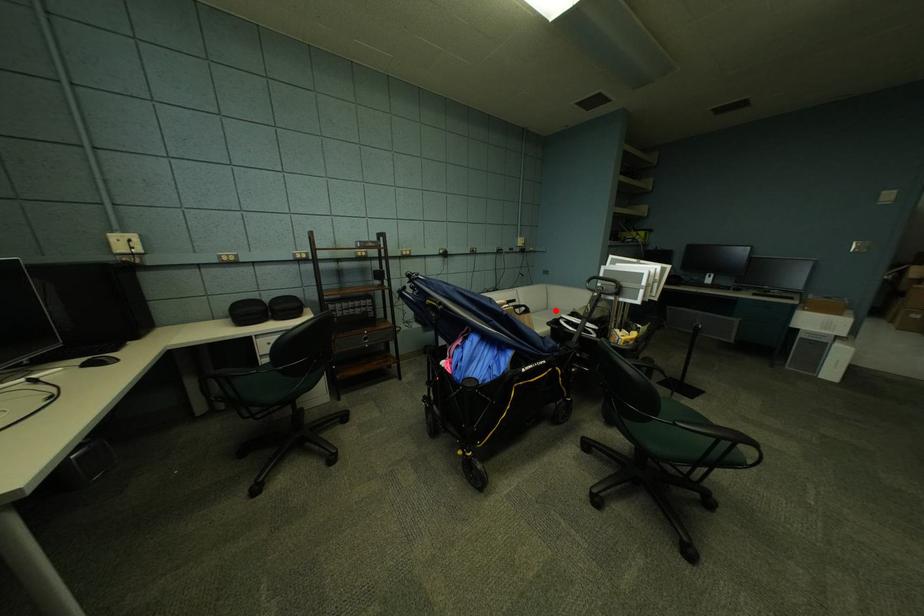
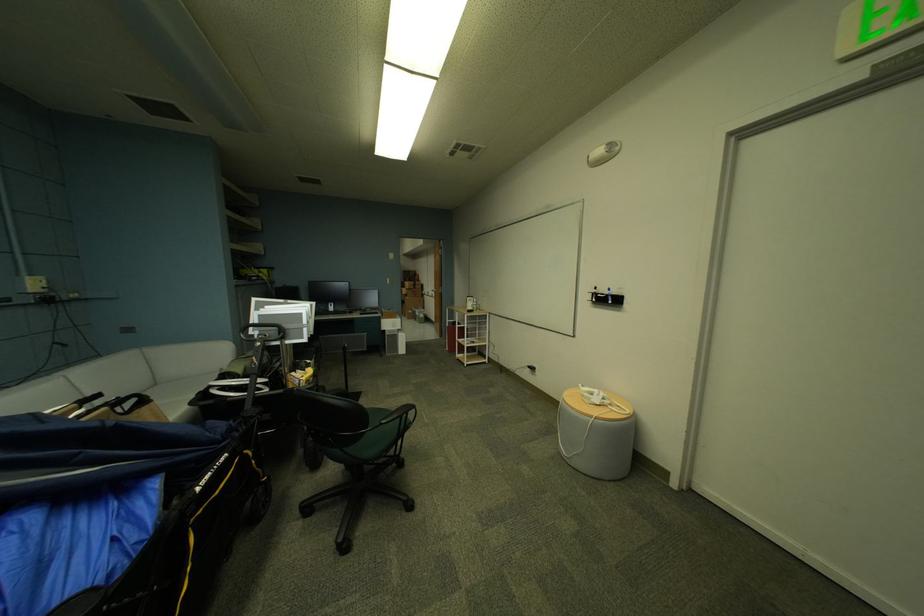
Question: I am providing you with two images of the same scene from different viewpoints. A red point is shown in image1. For the corresponding object point in image2, is it positioned nearer or farther from the camera?

Choices:
 (A) Nearer
 (B) Farther

Answer: (A)